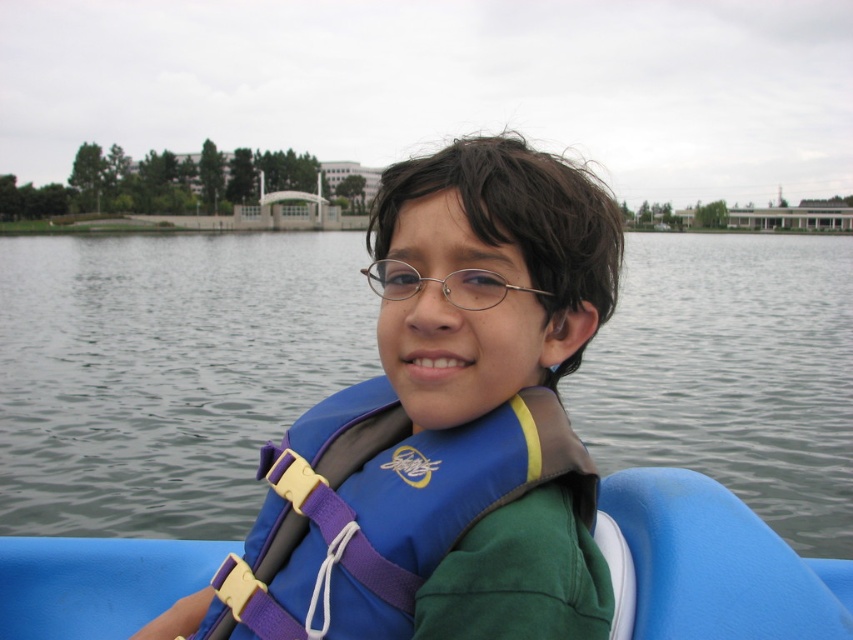
Who is taller, blue plastic boat at center or metallic oval glasses at center?

Standing taller between the two is blue plastic boat at center.

Does point (645, 588) come farther from viewer compared to point (460, 289)?

No, it is not.

What are the coordinates of `blue plastic boat at center` in the screenshot? It's located at click(718, 564).

Locate an element on the screen. This screenshot has height=640, width=853. blue plastic boat at center is located at coordinates (718, 564).

Does gray water at center appear on the left side of metallic oval glasses at center?

Yes, gray water at center is to the left of metallic oval glasses at center.

Between gray water at center and metallic oval glasses at center, which one has more height?

With more height is gray water at center.

Measure the distance between gray water at center and camera.

A distance of 7.57 meters exists between gray water at center and camera.

You are a GUI agent. You are given a task and a screenshot of the screen. Output one action in this format:
    pyautogui.click(x=<x>, y=<y>)
    Task: Click on the gray water at center
    
    Given the screenshot: What is the action you would take?
    pyautogui.click(x=165, y=372)

In the scene shown: Does blue fabric life vest at center have a greater width compared to metallic oval glasses at center?

Yes, blue fabric life vest at center is wider than metallic oval glasses at center.

How far apart are blue fabric life vest at center and metallic oval glasses at center?

A distance of 21.33 inches exists between blue fabric life vest at center and metallic oval glasses at center.

I want to click on blue fabric life vest at center, so click(x=444, y=433).

This screenshot has height=640, width=853. I want to click on blue fabric life vest at center, so click(x=444, y=433).